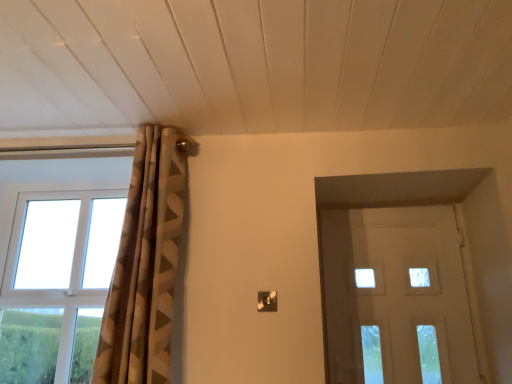
Question: Is point [x=56, y=329] closer or farther from the camera than point [x=360, y=230]?

Choices:
 (A) farther
 (B) closer

Answer: (B)

Question: In the image, is white plastic window at left on the left side or the right side of white frosted glass door at right?

Choices:
 (A) right
 (B) left

Answer: (B)

Question: Which object is the farthest from the white frosted glass door at right?

Choices:
 (A) white plastic window at left
 (B) brown textured curtain at upper left

Answer: (A)

Question: Which object is the closest to the white frosted glass door at right?

Choices:
 (A) white plastic window at left
 (B) brown textured curtain at upper left

Answer: (B)